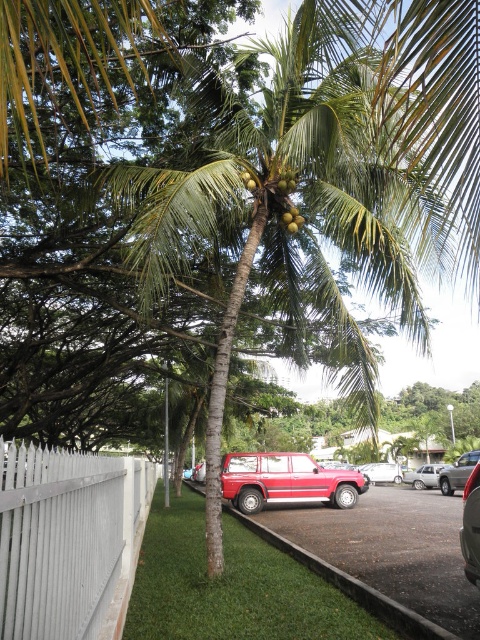
You are a gardener trying to determine the relative sizes of the green leafy palm tree at center and the white painted wood fence at lower left. Which object is larger?

The white painted wood fence at lower left is larger than the green leafy palm tree at center according to the description.

You are a gardener trying to prune the green leafy palm tree at center. You have a ladder that is 3 meters long. Can you reach the green matte coconut at upper center with your ladder?

The distance between the green leafy palm tree at center and the green matte coconut at upper center is 3.16 meters. Since the ladder is only 3 meters long, it is 0.16 meters too short to reach the green matte coconut at upper center.